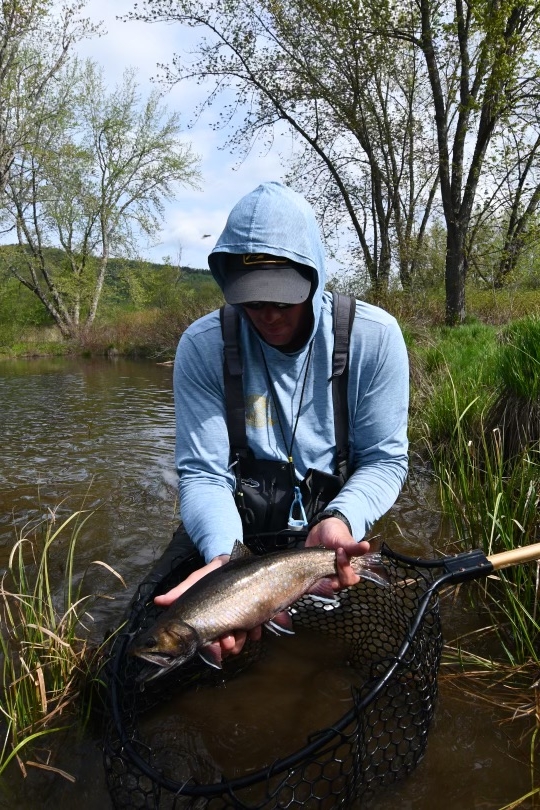
Where is `hood`? hood is located at coordinates (261, 219).